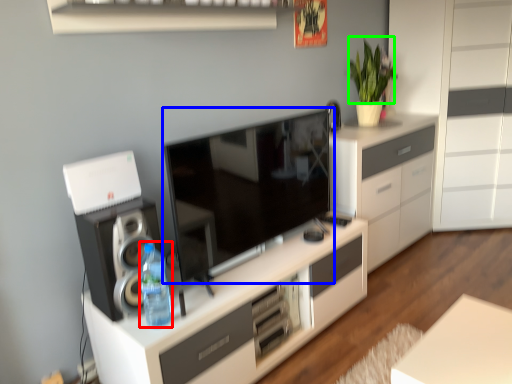
Question: Which is nearer to the bottle (highlighted by a red box)? television (highlighted by a blue box) or plant (highlighted by a green box).

Choices:
 (A) television
 (B) plant

Answer: (A)